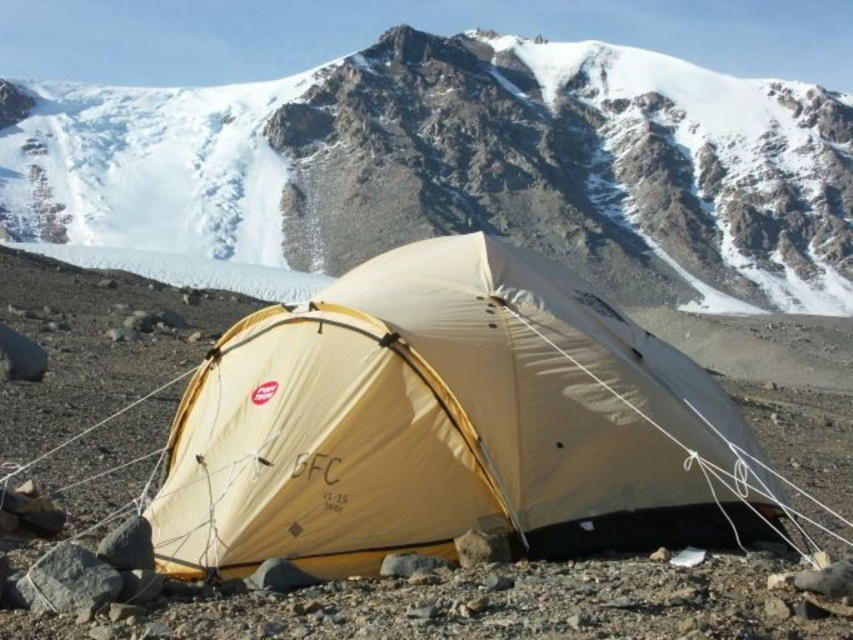
You are setting up a campsite and need to place a new tent. The existing white matte tent at center is already positioned at coordinates point 0.261, 0.543. If you want to place your new tent 1.5 meters to the northeast of the existing one, what are the new coordinates?

A: The new coordinates would be calculated by adding the displacement to the existing coordinates. However, without knowing the scale of the coordinate system, we cannot provide exact numerical values. Please ensure the new tent is placed 1.5 meters northeast of the white matte tent at center.

You are hiking and want to set up your tent near the white matte tent at center and the beige nylon tent at center. Based on their positions, which tent should you approach first if you want to reach the one closer to you first?

You should approach the white matte tent at center first because it is closer to you than the beige nylon tent at center, which is further away.